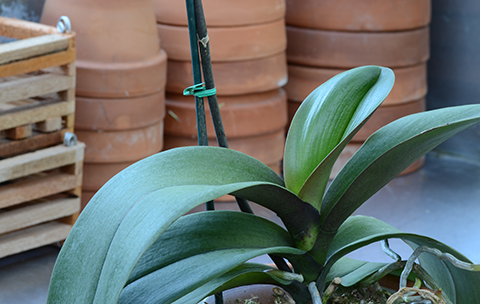
The width and height of the screenshot is (480, 304). What are the coordinates of `wall` in the screenshot? It's located at (457, 69).